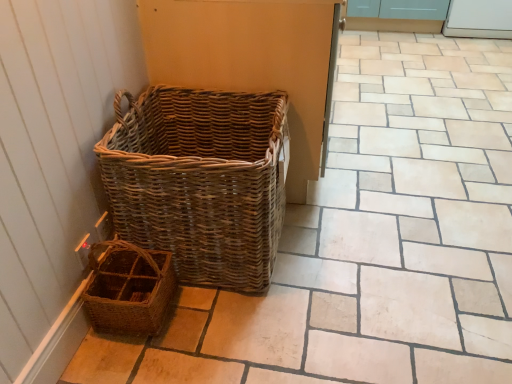
Where is `vacant space that is in between natural wicker picnic basket at left, placed as the second picnic basket when sorted from bottom to top, and brown woven picnic basket at lower left, acting as the 1th picnic basket starting from the bottom`? vacant space that is in between natural wicker picnic basket at left, placed as the second picnic basket when sorted from bottom to top, and brown woven picnic basket at lower left, acting as the 1th picnic basket starting from the bottom is located at coordinates (210, 314).